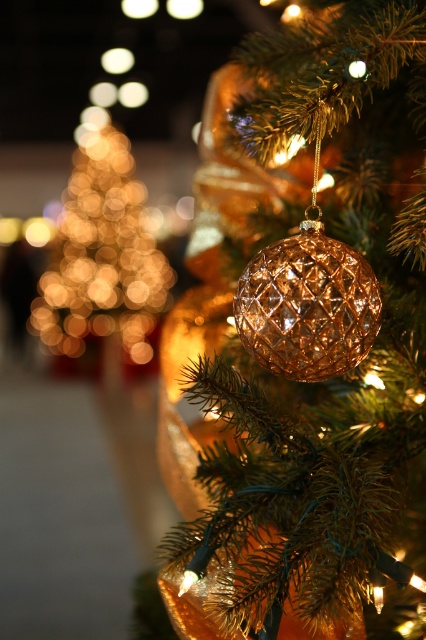
Question: Does shiny gold ornament at center lie behind gold textured ball at center?

Choices:
 (A) no
 (B) yes

Answer: (A)

Question: Can you confirm if shiny gold ornament at center is smaller than gold textured ball at center?

Choices:
 (A) yes
 (B) no

Answer: (B)

Question: Which point is closer to the camera taking this photo?

Choices:
 (A) (305, 236)
 (B) (368, 113)

Answer: (A)

Question: Which object appears farthest from the camera in this image?

Choices:
 (A) gold textured ball at center
 (B) shiny gold ornament at center

Answer: (A)

Question: Does shiny gold ornament at center have a larger size compared to gold textured ball at center?

Choices:
 (A) no
 (B) yes

Answer: (B)